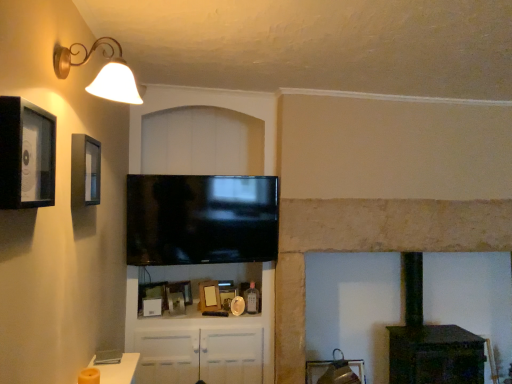
Question: Is wooden photo frame at center, the third picture frame ordered from the bottom, to the left or to the right of wooden picture frame at center, which ranks as the 2th picture frame in back-to-front order, in the image?

Choices:
 (A) left
 (B) right

Answer: (B)

Question: From the image's perspective, is wooden photo frame at center, which is counted as the third picture frame, starting from the back, located above or below wooden picture frame at center, which is counted as the 4th picture frame, starting from the top?

Choices:
 (A) below
 (B) above

Answer: (B)

Question: Estimate the real-world distances between objects in this image. Which object is farther from the black matte picture frame at left, the 1th picture frame when ordered from front to back?

Choices:
 (A) wooden photo frame at center, the third picture frame ordered from the bottom
 (B) wooden picture frame at center, the fifth picture frame positioned from the front
 (C) gold metallic wall sconce at upper left
 (D) wooden picture frame at center, the 4th picture frame from the front
 (E) black glossy flat-screen tv at center

Answer: (B)

Question: Which object is the farthest from the wooden picture frame at center, marked as the fifth picture frame in a top-to-bottom arrangement?

Choices:
 (A) black matte picture frame at upper left, the second picture frame in the top-to-bottom sequence
 (B) black glossy flat-screen tv at center
 (C) wooden photo frame at center, which appears as the third picture frame when viewed from the front
 (D) black matte picture frame at left, which is the first picture frame in top-to-bottom order
 (E) dark green wood stove at lower right

Answer: (D)